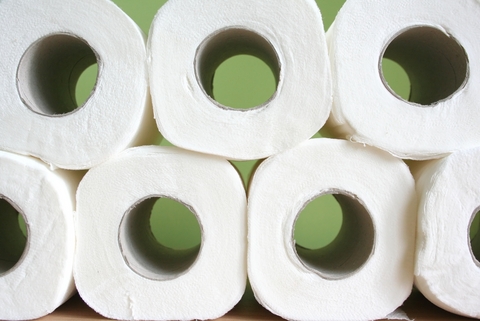
At what (x,y) coordinates should I click in order to perform the action: click on toilet paper rolls. Please return your answer as a coordinate pair (x, y). Looking at the image, I should click on (129, 77), (178, 63), (365, 55), (452, 209), (354, 172), (201, 189), (58, 200).